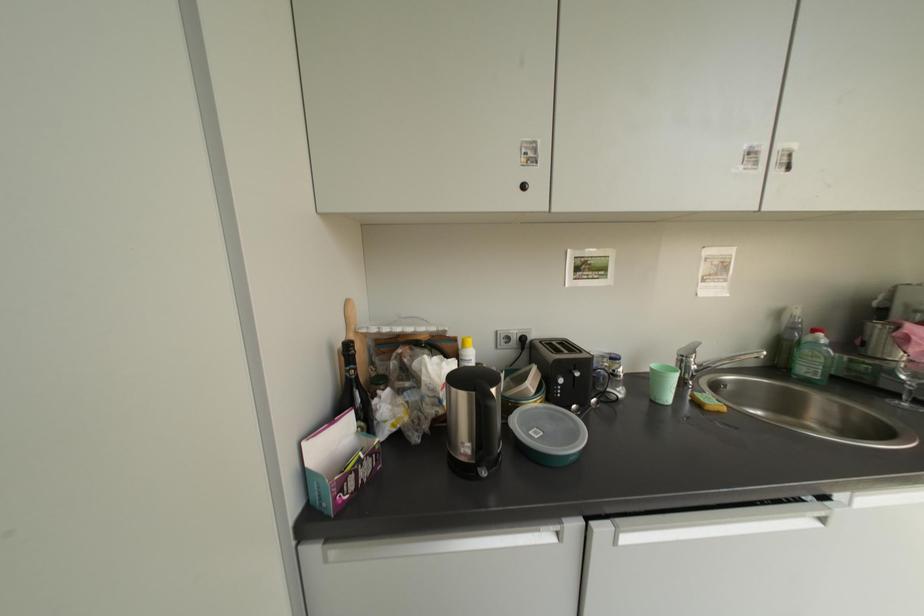
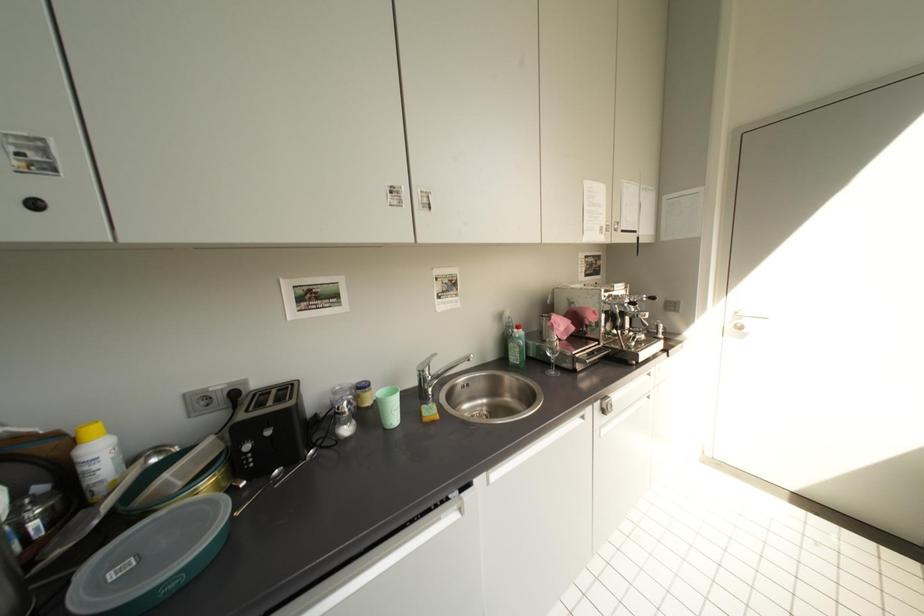
Question: Based on the continuous images, in which direction is the camera rotating? Reply with the corresponding letter.

Choices:
 (A) Left
 (B) Right
 (C) Up
 (D) Down

Answer: (B)